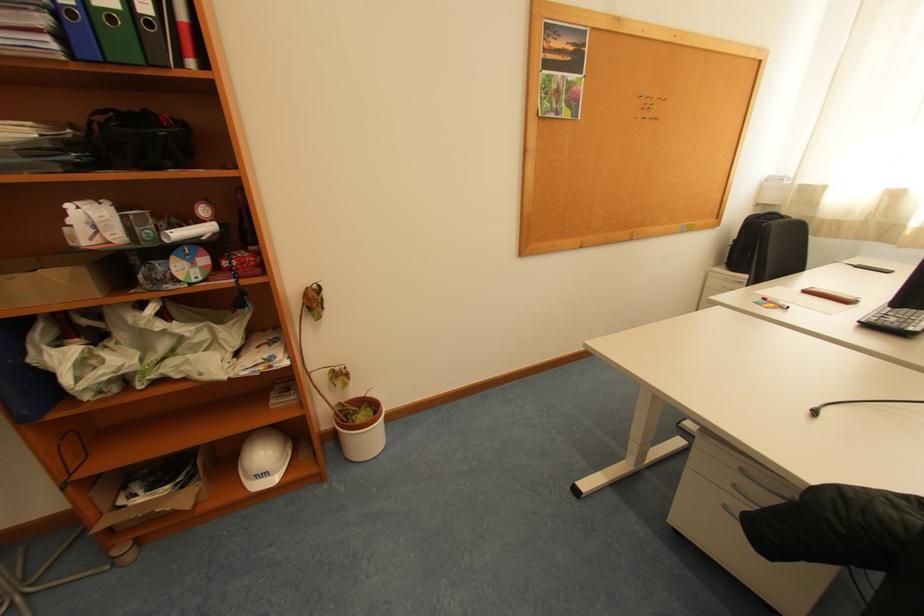
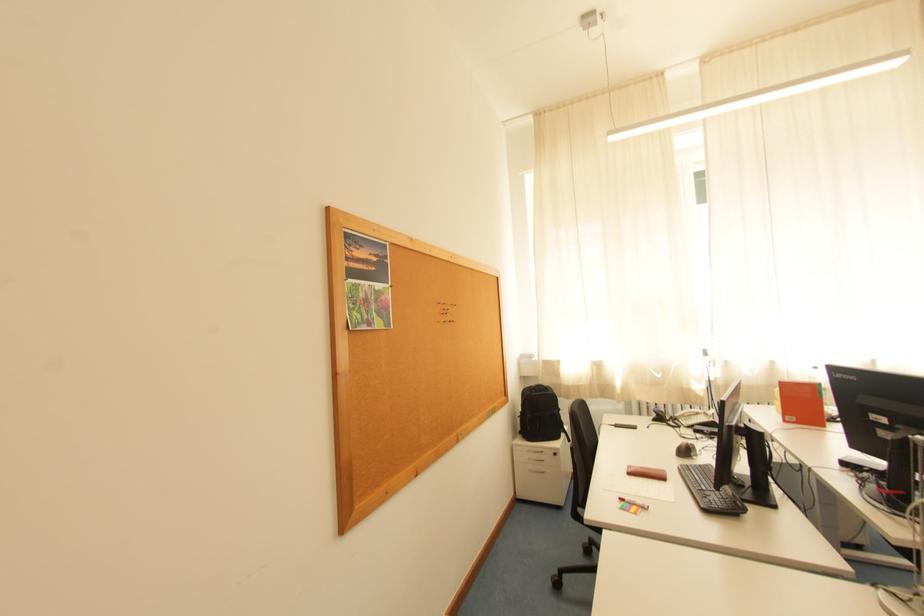
The first image is from the beginning of the video and the second image is from the end. How did the camera likely rotate when shooting the video?

The rotation direction of the camera is right-up.